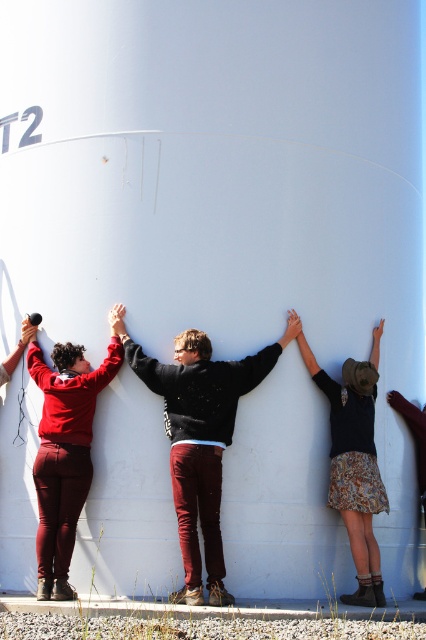
You are a fashion designer observing the group. Which person has a wider garment between the dark gray sweater at center and the matte red pants at left?

The dark gray sweater at center has a greater width than the matte red pants at left.

You are a photographer trying to capture a group photo of the dark gray sweater at center and the patterned skirt at center. The camera you are using has a maximum focus range of 3 feet. Can you fit both subjects within the focus range?

The distance between the dark gray sweater at center and the patterned skirt at center is 3.47 feet, which exceeds the camera focus range of 3 feet. Therefore, you cannot fit both subjects within the focus range.

You are standing in front of the tank and see the matte red pants at left and the patterned skirt at center. Which clothing item is positioned more to the left side?

The matte red pants at left are positioned more to the left side than the patterned skirt at center.